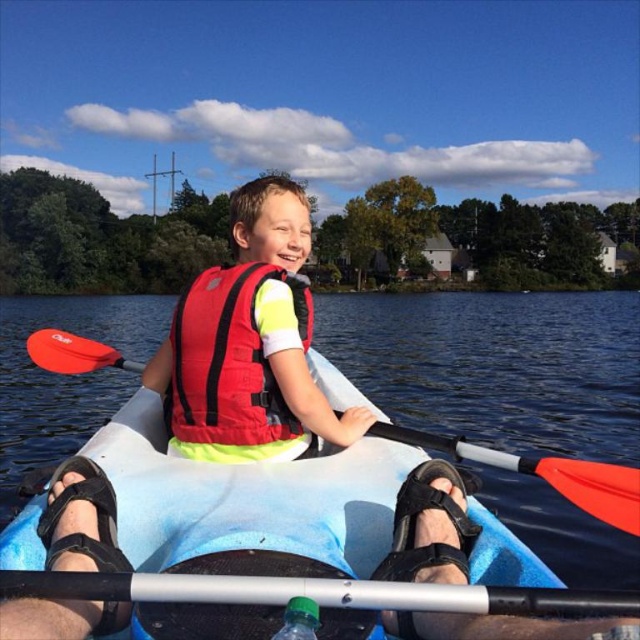
Question: Does red nylon life jacket at center appear under green translucent bottle at lower center?

Choices:
 (A) no
 (B) yes

Answer: (A)

Question: Which point is farther to the camera?

Choices:
 (A) green translucent bottle at lower center
 (B) matte red life vest at center
 (C) red nylon life jacket at center

Answer: (B)

Question: Which point is closer to the camera?

Choices:
 (A) matte red life vest at center
 (B) red nylon life jacket at center
 (C) black plastic paddle at lower center

Answer: (C)

Question: Is matte red life vest at center positioned behind red nylon life jacket at center?

Choices:
 (A) yes
 (B) no

Answer: (A)

Question: Which point is farther to the camera?

Choices:
 (A) (509, 598)
 (B) (275, 634)
 (C) (307, 323)
 (D) (273, 429)

Answer: (C)

Question: Does matte red life vest at center appear over orange paddle at center?

Choices:
 (A) no
 (B) yes

Answer: (B)